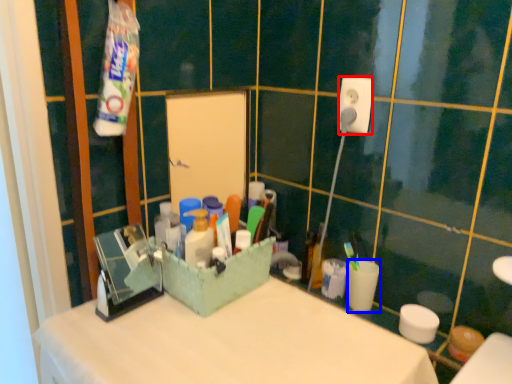
Question: Among these objects, which one is farthest to the camera, power plugs and sockets (highlighted by a red box) or coffee cup (highlighted by a blue box)?

Choices:
 (A) power plugs and sockets
 (B) coffee cup

Answer: (B)